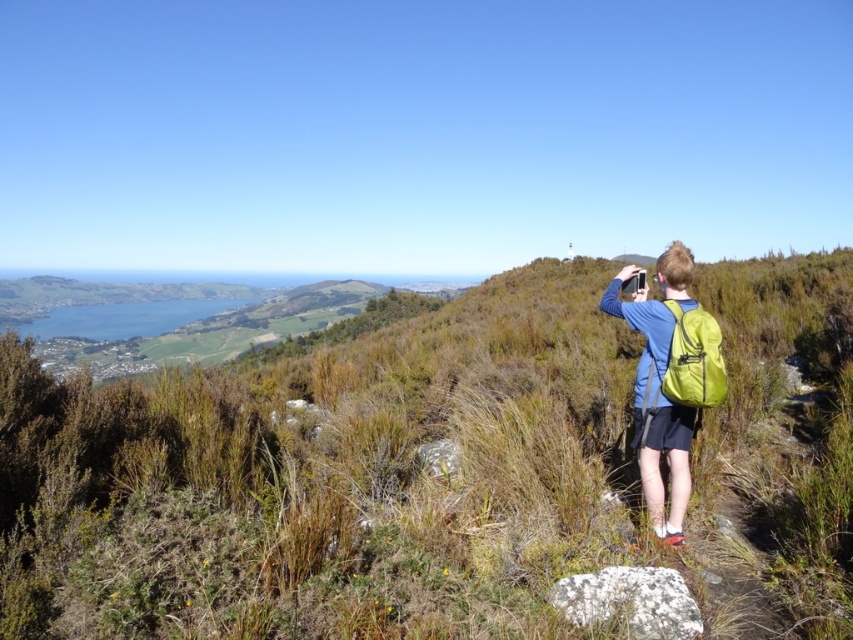
Question: Which point is farther to the camera?

Choices:
 (A) green fabric backpack at right
 (B) green grassy at center

Answer: (A)

Question: Does green grassy at center appear over blue fabric backpack at right?

Choices:
 (A) yes
 (B) no

Answer: (A)

Question: Can you confirm if green grassy at center is bigger than green fabric backpack at right?

Choices:
 (A) yes
 (B) no

Answer: (A)

Question: Which point is farther to the camera?

Choices:
 (A) (695, 314)
 (B) (401, 509)
 (C) (682, 244)

Answer: (B)

Question: Considering the real-world distances, which object is closest to the green fabric backpack at right?

Choices:
 (A) blue fabric backpack at right
 (B) green grassy at center

Answer: (A)

Question: In this image, where is blue fabric backpack at right located relative to green fabric backpack at right?

Choices:
 (A) above
 (B) below

Answer: (B)